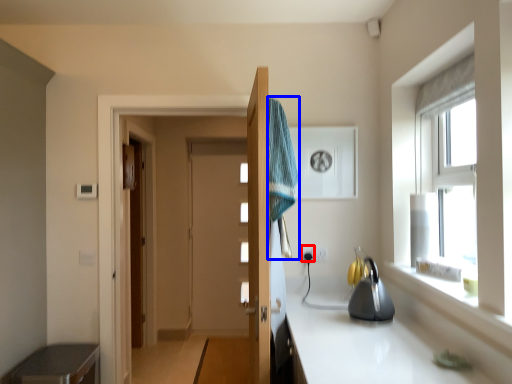
Question: Which object appears closest to the camera in this image, electric outlet (highlighted by a red box) or bath towel (highlighted by a blue box)?

Choices:
 (A) electric outlet
 (B) bath towel

Answer: (B)